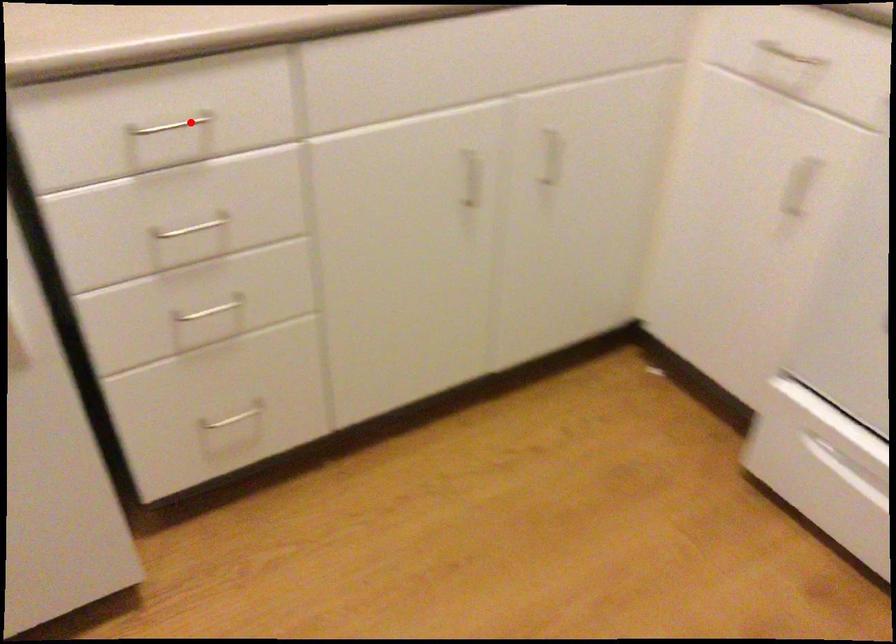
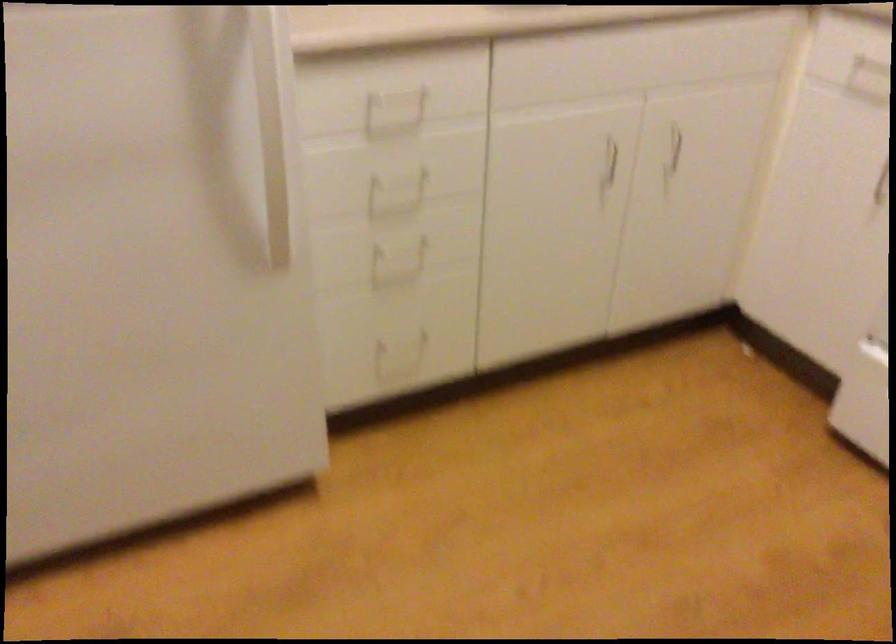
In the second image, find the point that corresponds to the highlighted location in the first image.

(403, 91)